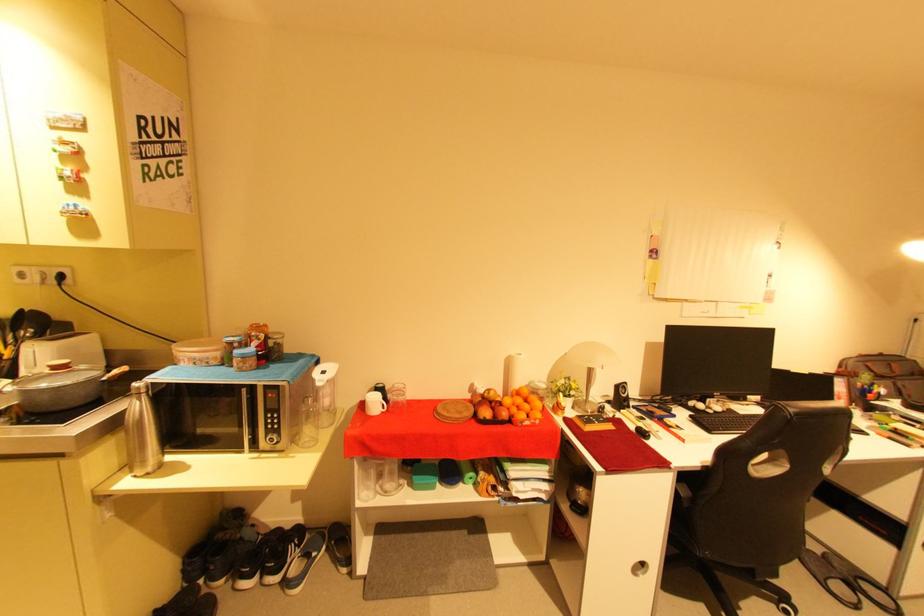
Find where to lift the pot handle. Please return your answer as a coordinate pair (x, y).

(116, 373)